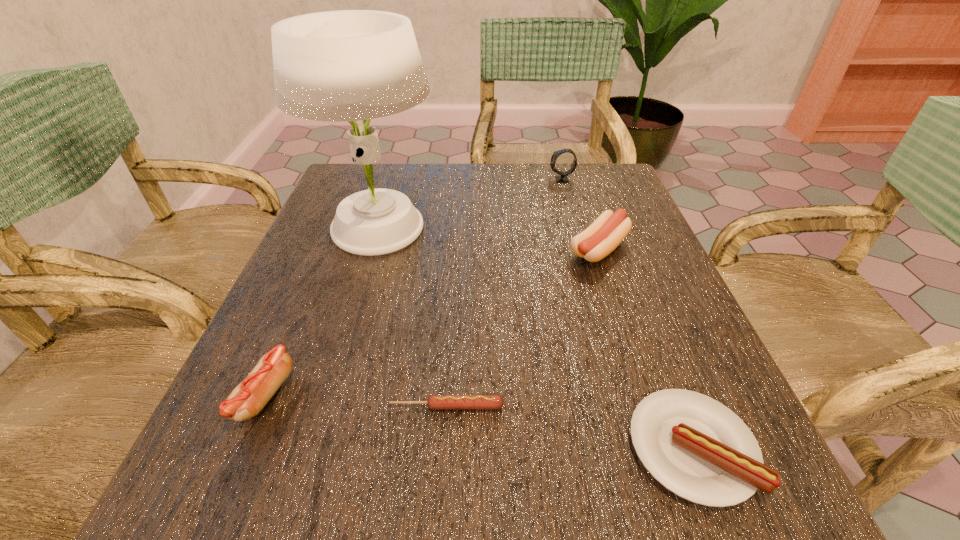
The width and height of the screenshot is (960, 540). I want to click on free space located 0.180m on the face of the second tallest object, so click(479, 179).

Identify the location of vacant space located 0.300m on the face of the second tallest object. (432, 179).

Identify the location of vacant space located on the front of the farthest sausage. The width and height of the screenshot is (960, 540). (628, 338).

This screenshot has width=960, height=540. I want to click on free location located on the right of the leftmost sausage, so tap(364, 396).

Where is `vacant space situated on the left of the second shortest object`? vacant space situated on the left of the second shortest object is located at coordinates (457, 448).

Locate an element on the screen. Image resolution: width=960 pixels, height=540 pixels. free space located on the right of the third sausage from right to left is located at coordinates (636, 406).

I want to click on lamp located in the far edge section of the desktop, so click(348, 65).

Find the location of a particular element. This screenshot has height=540, width=960. watch at the far edge is located at coordinates (563, 176).

Identify the location of object located in the near edge section of the desktop. (696, 447).

Locate an element on the screen. The image size is (960, 540). lamp present at the left edge is located at coordinates (348, 65).